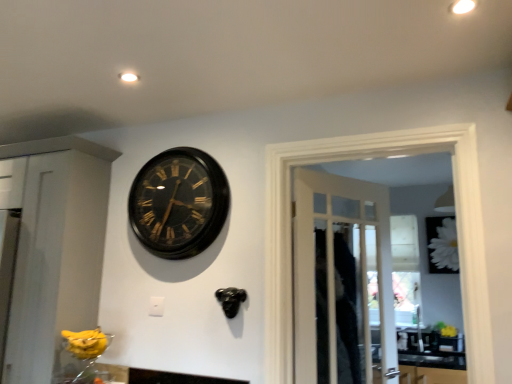
Question: Is wooden door at center not within white glossy sink at lower right?

Choices:
 (A) yes
 (B) no

Answer: (A)

Question: Is wooden door at center oriented towards white glossy sink at lower right?

Choices:
 (A) yes
 (B) no

Answer: (B)

Question: From a real-world perspective, is wooden door at center positioned under white glossy sink at lower right based on gravity?

Choices:
 (A) yes
 (B) no

Answer: (B)

Question: From a real-world perspective, is wooden door at center physically above white glossy sink at lower right?

Choices:
 (A) no
 (B) yes

Answer: (B)

Question: Is wooden door at center turned away from white glossy sink at lower right?

Choices:
 (A) no
 (B) yes

Answer: (A)

Question: Which is correct: black polished wood clock at upper center is inside white glossy sink at lower right, or outside of it?

Choices:
 (A) inside
 (B) outside

Answer: (B)

Question: Considering the positions of point (198, 223) and point (396, 344), is point (198, 223) closer or farther from the camera than point (396, 344)?

Choices:
 (A) closer
 (B) farther

Answer: (A)

Question: From their relative heights in the image, would you say black polished wood clock at upper center is taller or shorter than white glossy sink at lower right?

Choices:
 (A) short
 (B) tall

Answer: (B)

Question: Is black polished wood clock at upper center in front of or behind white glossy sink at lower right in the image?

Choices:
 (A) front
 (B) behind

Answer: (A)

Question: Is white glossy sink at lower right taller or shorter than wooden door at center?

Choices:
 (A) short
 (B) tall

Answer: (A)

Question: In terms of width, does white glossy sink at lower right look wider or thinner when compared to wooden door at center?

Choices:
 (A) wide
 (B) thin

Answer: (A)

Question: In the image, is white glossy sink at lower right positioned in front of or behind wooden door at center?

Choices:
 (A) front
 (B) behind

Answer: (B)

Question: Does point (411, 337) appear closer or farther from the camera than point (295, 314)?

Choices:
 (A) closer
 (B) farther

Answer: (B)

Question: From the image's perspective, relative to black polished wood clock at upper center, is wooden door at center above or below?

Choices:
 (A) above
 (B) below

Answer: (B)

Question: In terms of height, does wooden door at center look taller or shorter compared to black polished wood clock at upper center?

Choices:
 (A) short
 (B) tall

Answer: (B)